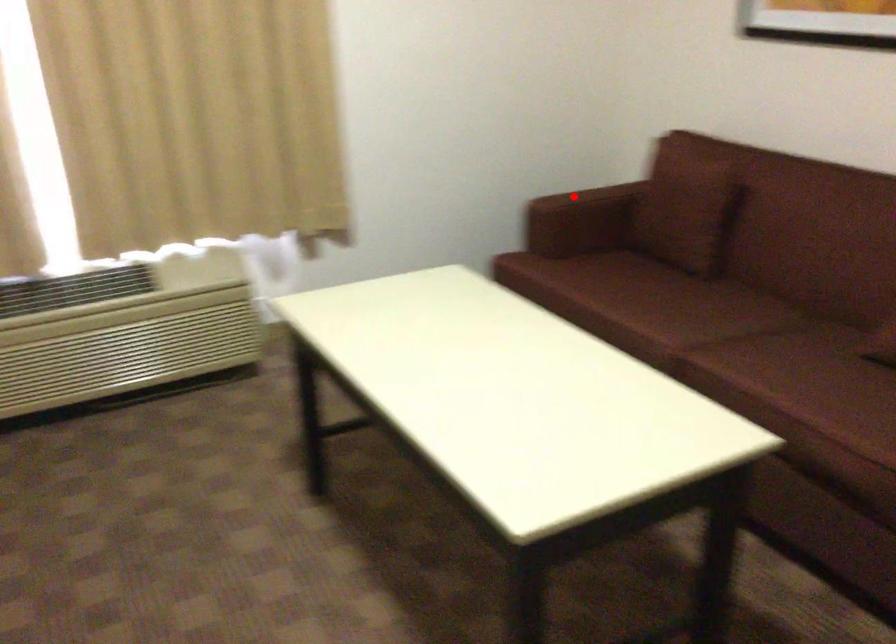
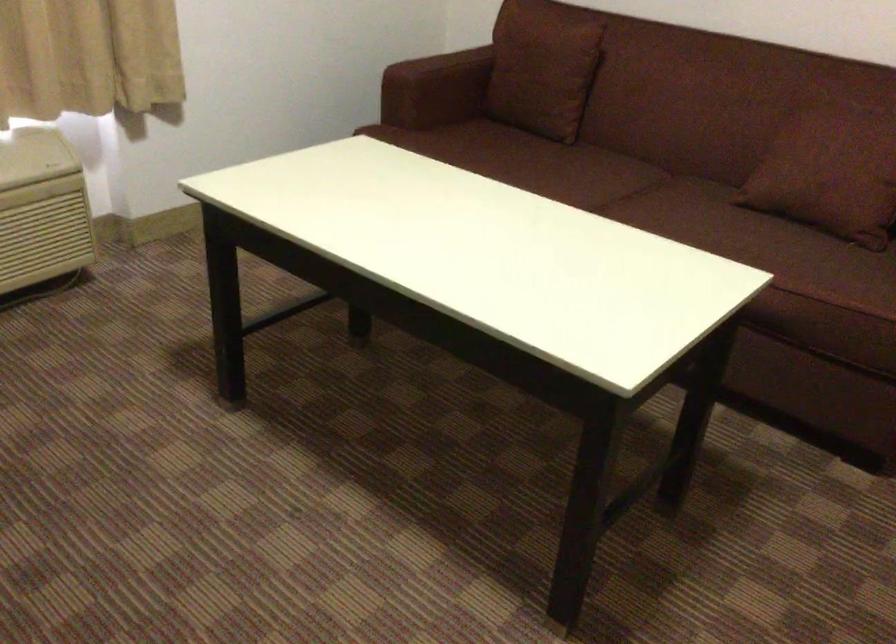
The point at the highlighted location is marked in the first image. Where is the corresponding point in the second image?

(441, 66)